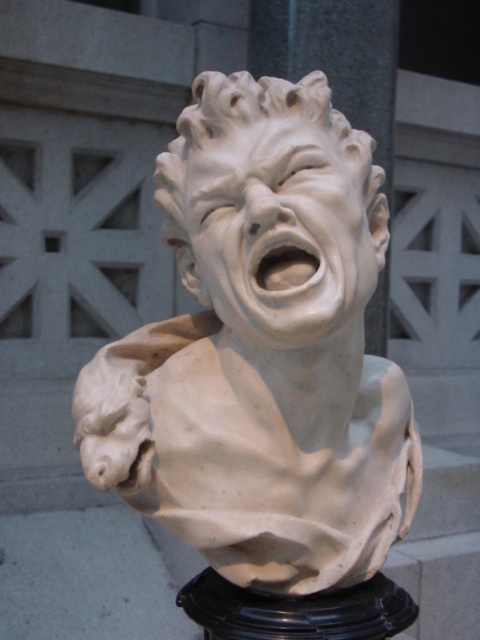
Does white marble bust at center have a greater height compared to white marble face at center?

Yes, white marble bust at center is taller than white marble face at center.

Locate an element on the screen. Image resolution: width=480 pixels, height=640 pixels. white marble bust at center is located at coordinates (263, 349).

Locate an element on the screen. The height and width of the screenshot is (640, 480). white marble bust at center is located at coordinates (263, 349).

Image resolution: width=480 pixels, height=640 pixels. I want to click on white marble bust at center, so click(x=263, y=349).